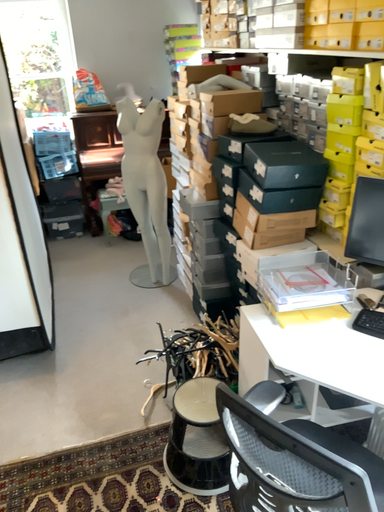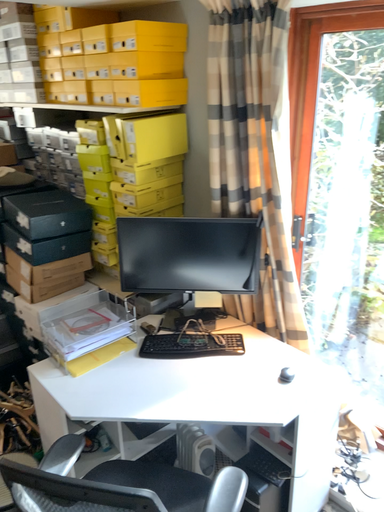
Question: Which way did the camera rotate in the video?

Choices:
 (A) rotated right
 (B) rotated left

Answer: (A)